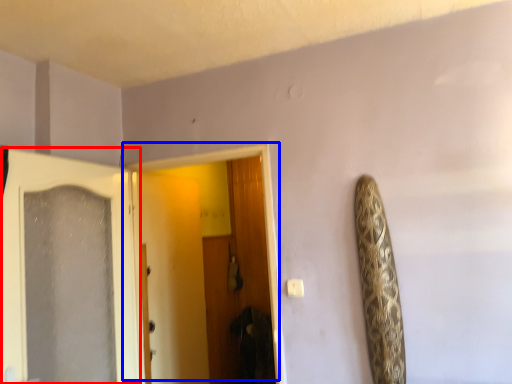
Question: Which point is further to the camera, door (highlighted by a red box) or door (highlighted by a blue box)?

Choices:
 (A) door
 (B) door

Answer: (B)